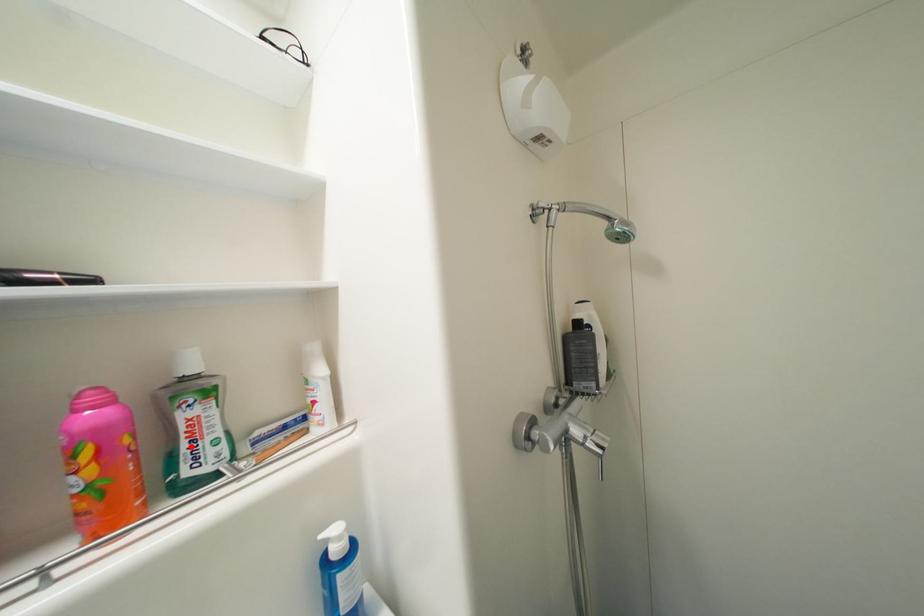
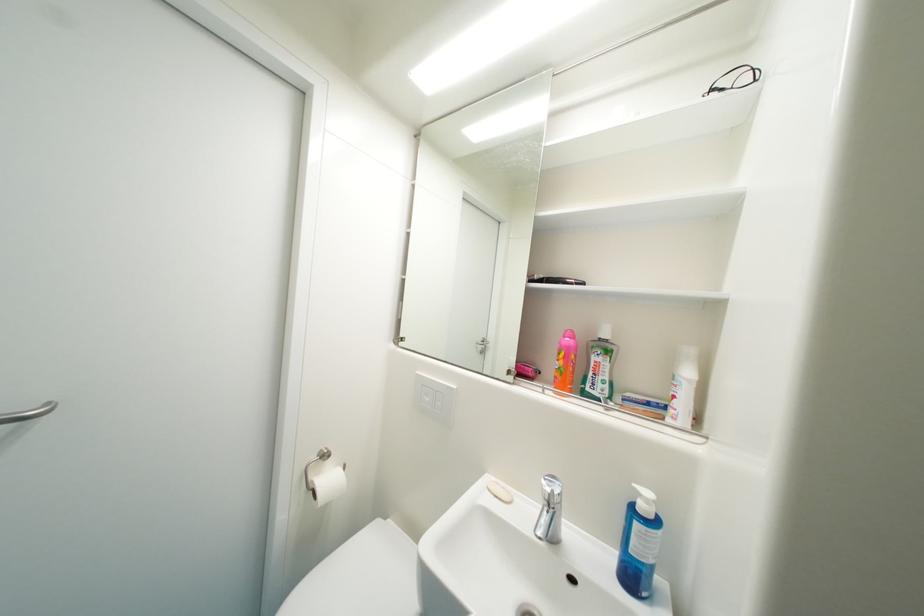
Question: I am providing you with two images of the same scene from different viewpoints. A red point is marked on the first image. Can you still see the location of the red point in image 2?

Choices:
 (A) Yes
 (B) No

Answer: (A)